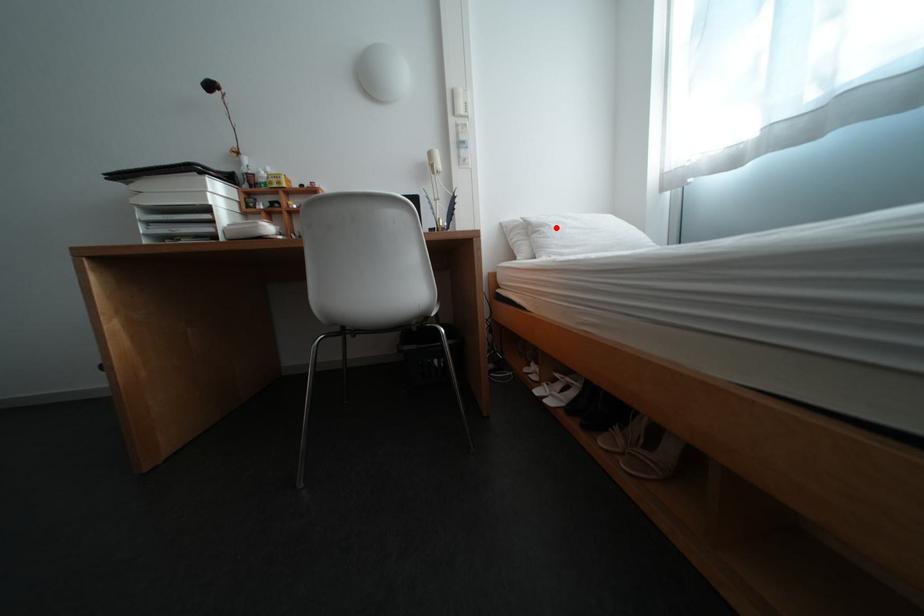
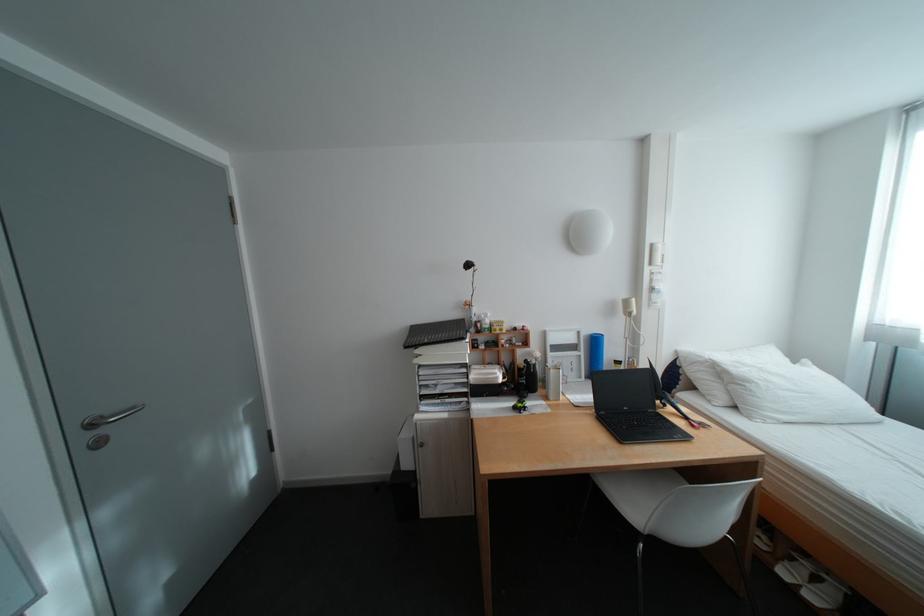
Question: I am providing you with two images of the same scene from different viewpoints. In image1, a red point is highlighted. Considering the same 3D point in image2, which of the following is correct?

Choices:
 (A) It is closer
 (B) It is farther

Answer: (B)